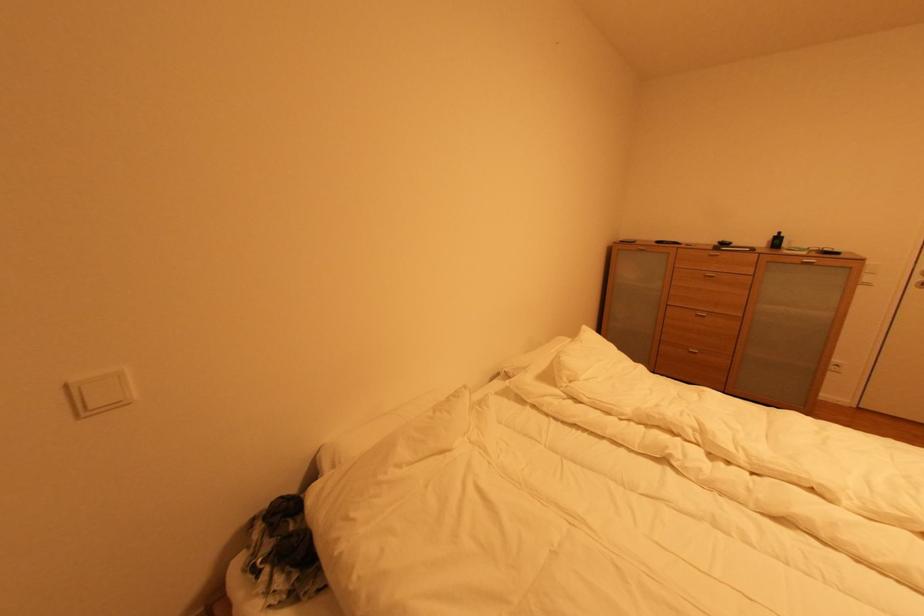
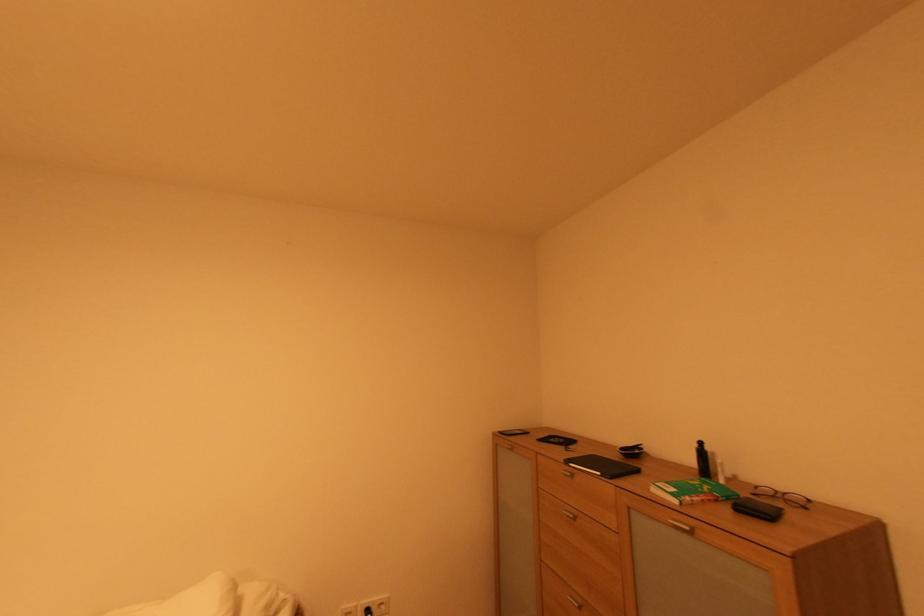
Find the pixel in the second image that matches (x=783, y=236) in the first image.

(701, 447)